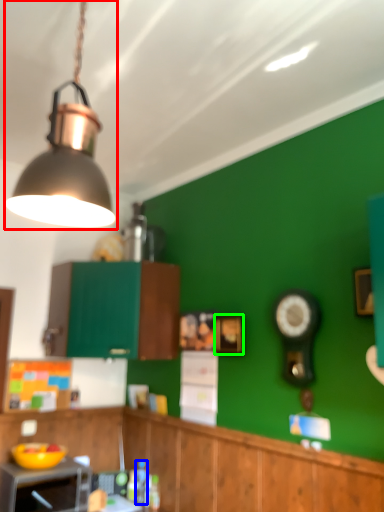
Question: Which object is positioned farthest from lamp (highlighted by a red box)? Select from bottle (highlighted by a blue box) and picture frame (highlighted by a green box).

Choices:
 (A) bottle
 (B) picture frame

Answer: (A)